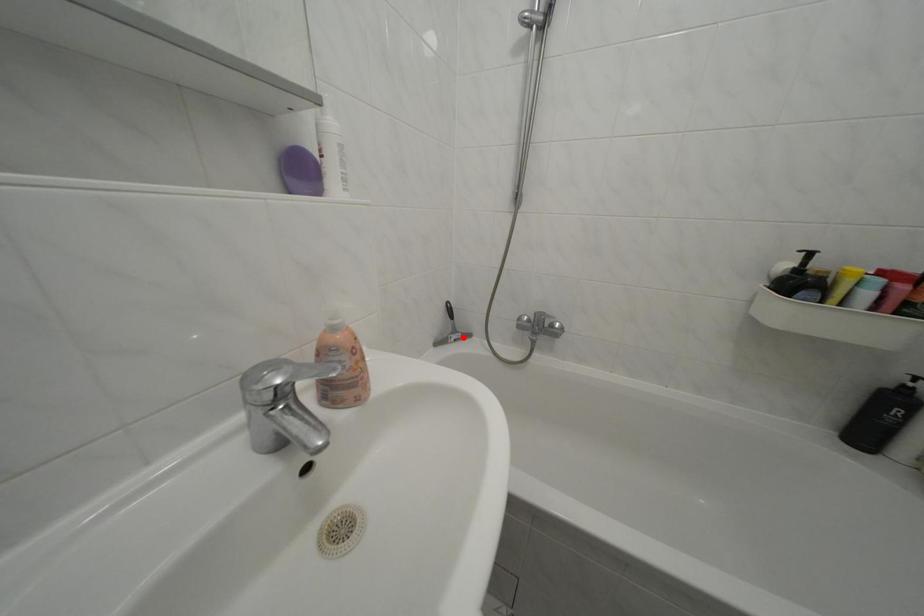
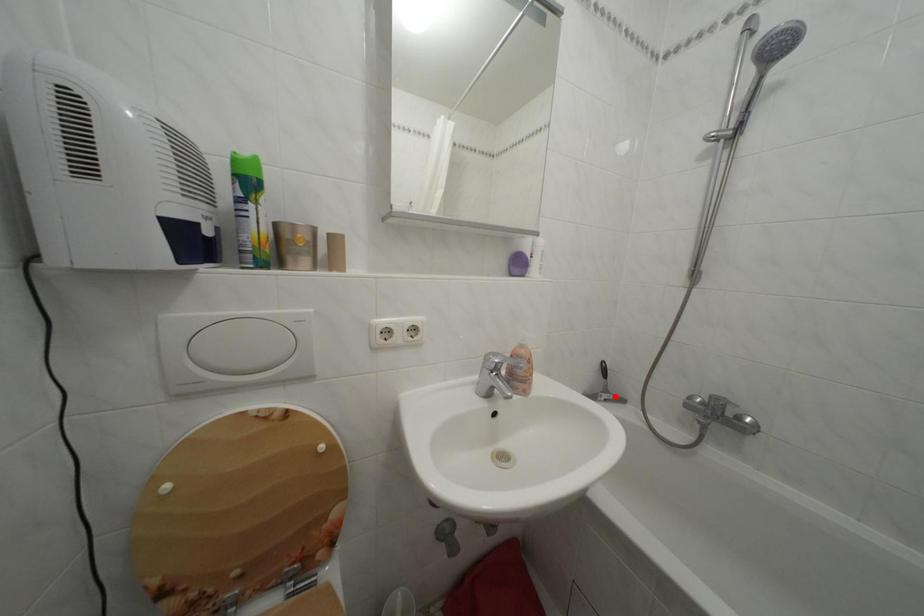
I am providing you with two images of the same scene from different viewpoints. A red point is marked on the first image and another point is marked on the second image. Is the red point in image1 aligned with the point shown in image2?

Yes